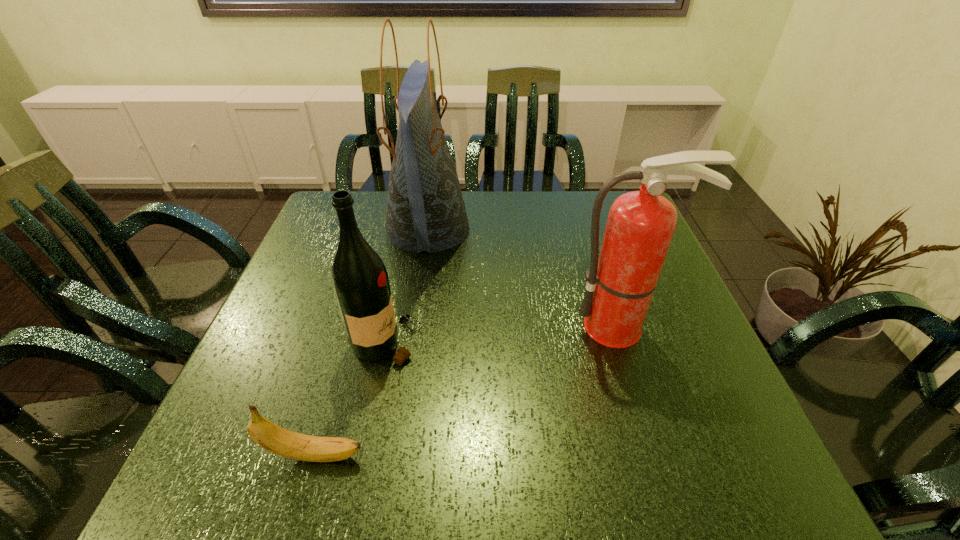
At what (x,y) coordinates should I click in order to perform the action: click on shopping bag. Please return your answer as a coordinate pair (x, y). Looking at the image, I should click on (426, 211).

Find the location of `the farthest object`. the farthest object is located at coordinates (426, 211).

You are a GUI agent. You are given a task and a screenshot of the screen. Output one action in this format:
    pyautogui.click(x=<x>, y=<y>)
    Task: Click on the fire extinguisher
    This screenshot has height=540, width=960.
    Given the screenshot: What is the action you would take?
    pyautogui.click(x=640, y=226)

This screenshot has width=960, height=540. In order to click on wine bottle in this screenshot , I will do `click(360, 280)`.

Identify the location of banana. (273, 438).

Find the location of a particular element. the shortest object is located at coordinates (273, 438).

Identify the location of free space located 0.100m on the left of the farthest object. (349, 229).

Image resolution: width=960 pixels, height=540 pixels. Identify the location of vacant space located 0.070m with the handle and hose on the rightmost object. (x=637, y=378).

The height and width of the screenshot is (540, 960). In order to click on vacant area located 0.260m on the surface of the wine bottle in this screenshot , I will do `click(547, 343)`.

I want to click on vacant space situated 0.190m at the start of the peel on the banana, so click(482, 455).